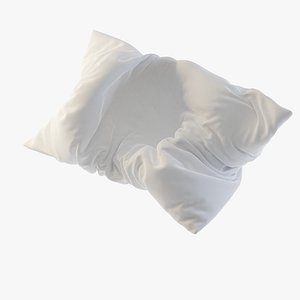
At what (x,y) coordinates should I click in order to perform the action: click on corners of the pillow. Please return your answer as a coordinate pair (x, y). Looking at the image, I should click on (194, 227), (283, 112), (97, 33), (27, 143).